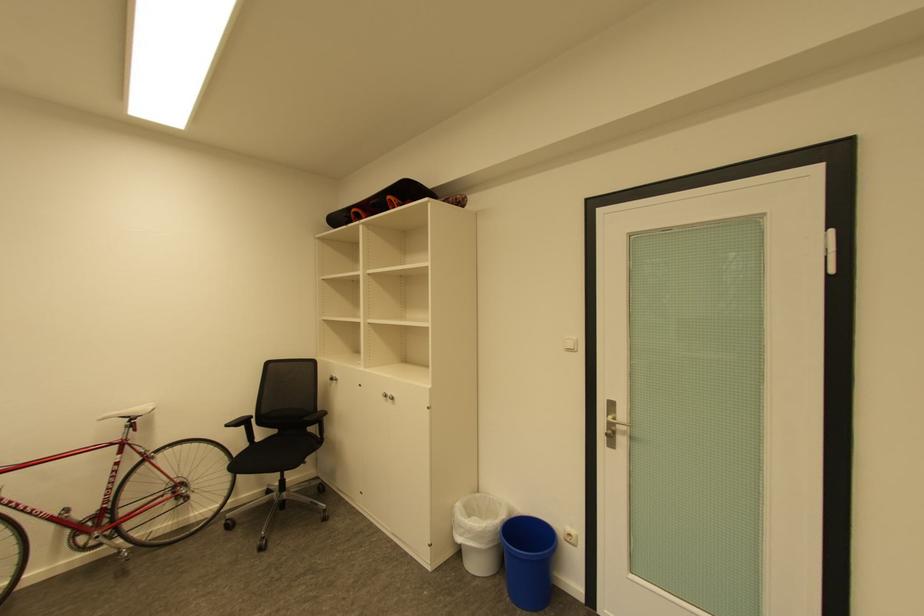
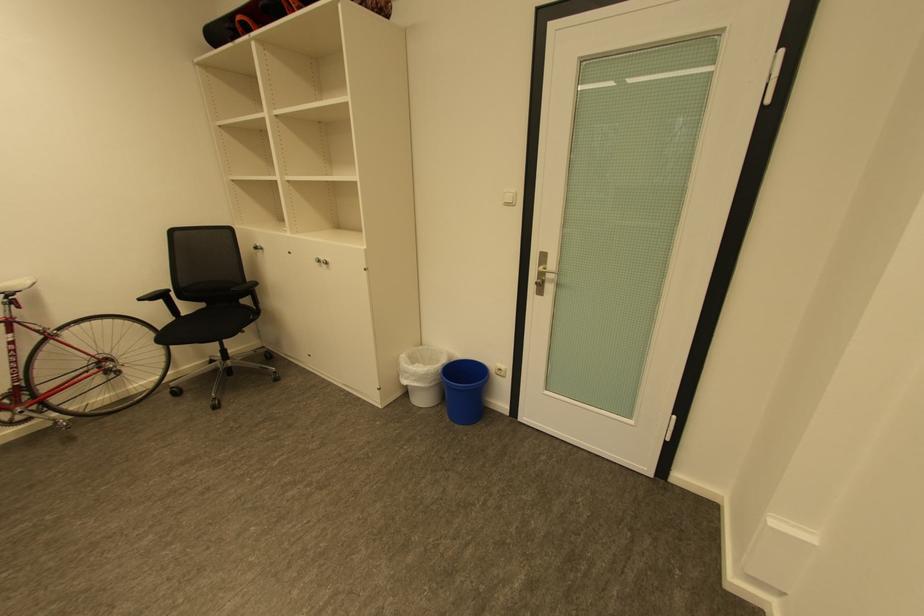
In the second image, find the point that corresponds to the point at 517,516 in the first image.

(456, 361)